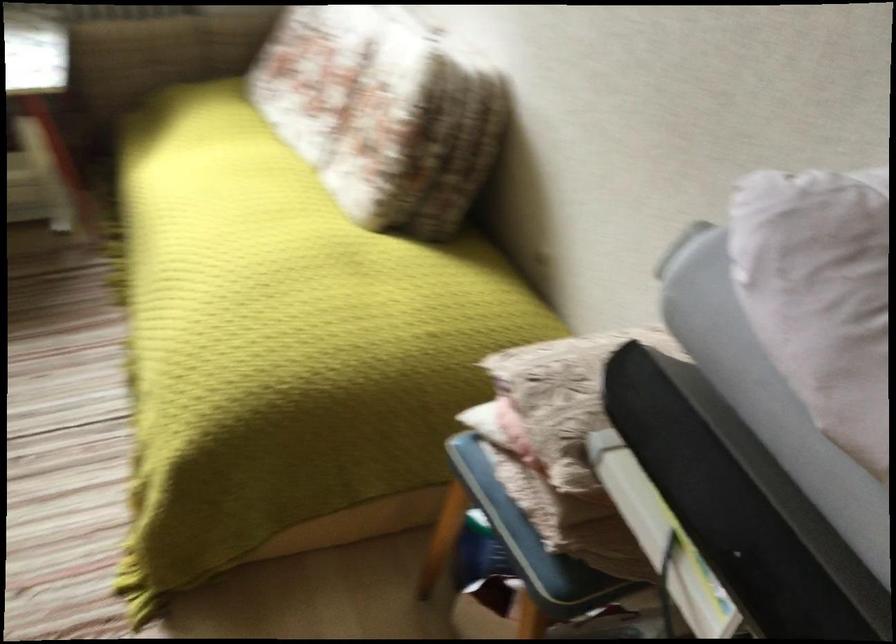
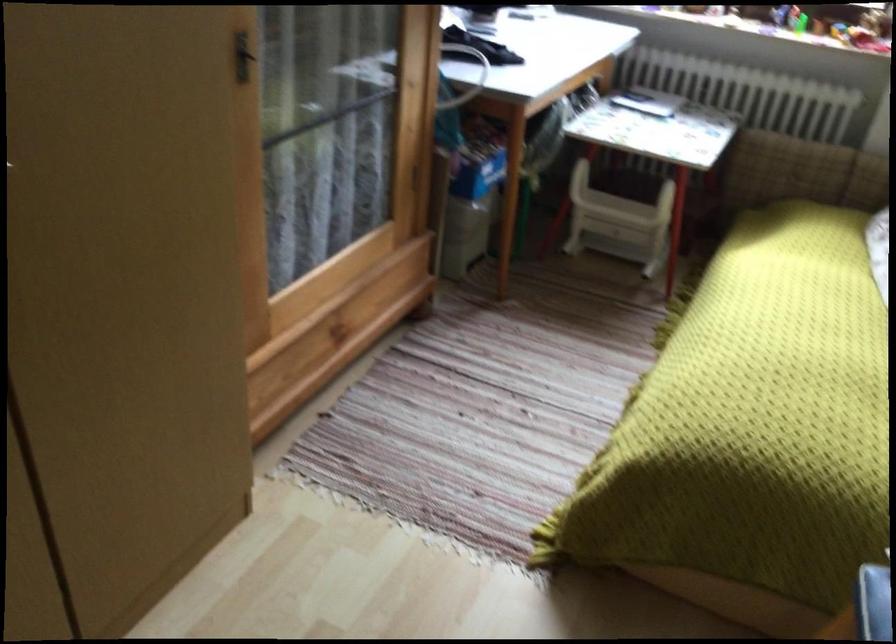
Question: The camera is either moving clockwise (left) or counter-clockwise (right) around the object. The first image is from the beginning of the video and the second image is from the end. Is the camera moving left or right when shooting the video?

Choices:
 (A) Left
 (B) Right

Answer: (B)